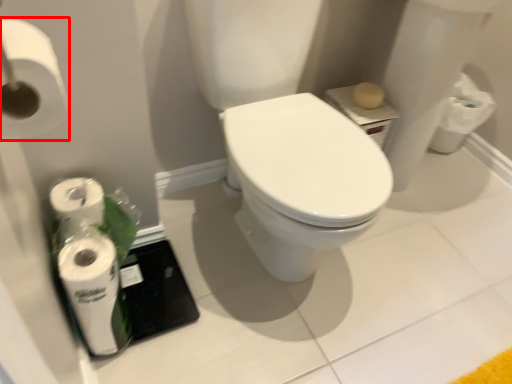
Question: Considering the relative positions of toilet paper (annotated by the red box) and toilet paper in the image provided, where is toilet paper (annotated by the red box) located with respect to the staircase?

Choices:
 (A) right
 (B) left

Answer: (A)